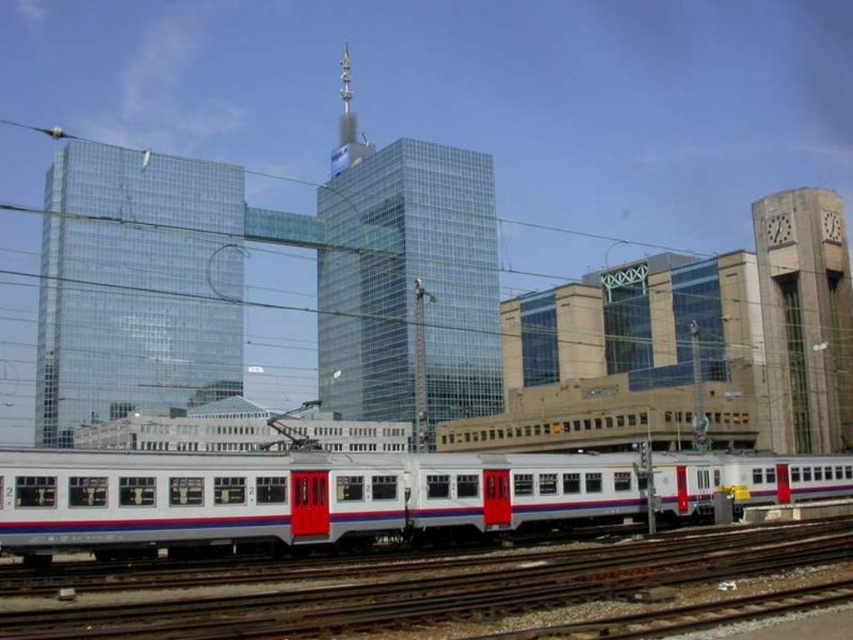
Which of these two, white metallic train at lower center or metallic track at lower center, stands shorter?

With less height is metallic track at lower center.

Who is positioned more to the left, white metallic train at lower center or metallic track at lower center?

Positioned to the left is white metallic train at lower center.

You are a GUI agent. You are given a task and a screenshot of the screen. Output one action in this format:
    pyautogui.click(x=<x>, y=<y>)
    Task: Click on the white metallic train at lower center
    
    Given the screenshot: What is the action you would take?
    pyautogui.click(x=294, y=497)